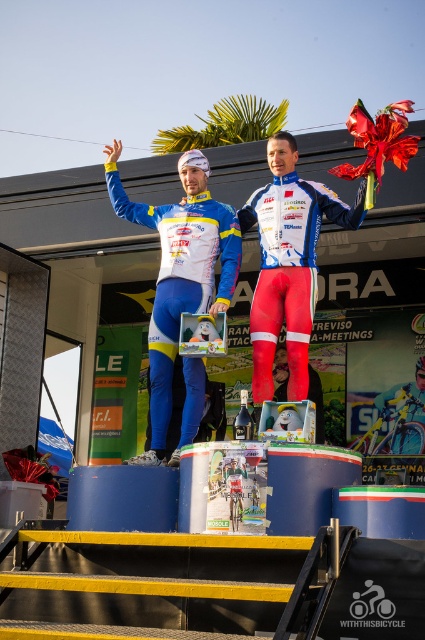
Which is behind, point (195, 364) or point (272, 364)?

Point (195, 364)

The height and width of the screenshot is (640, 425). What are the coordinates of `blue/white jersey at center` in the screenshot? It's located at (178, 273).